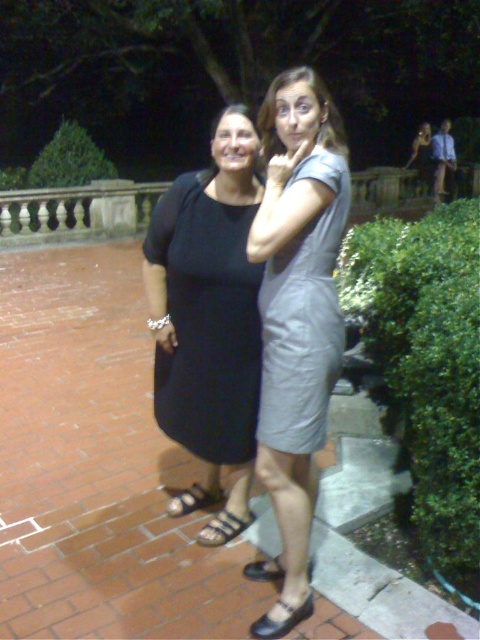
Is gray leather dress at center to the right of brown leather sandal at lower left from the viewer's perspective?

Yes, gray leather dress at center is to the right of brown leather sandal at lower left.

You are a GUI agent. You are given a task and a screenshot of the screen. Output one action in this format:
    pyautogui.click(x=<x>, y=<y>)
    Task: Click on the gray leather dress at center
    The width and height of the screenshot is (480, 640).
    Given the screenshot: What is the action you would take?
    pyautogui.click(x=298, y=300)

Does point (300, 109) lie in front of point (200, 506)?

That is True.

The width and height of the screenshot is (480, 640). Identify the location of gray leather dress at center. (298, 300).

Can you confirm if light gray leather dress at center is positioned to the right of black leather sandal at lower left?

Indeed, light gray leather dress at center is positioned on the right side of black leather sandal at lower left.

Does light gray leather dress at center appear on the left side of black leather sandal at lower left?

In fact, light gray leather dress at center is to the right of black leather sandal at lower left.

In order to click on light gray leather dress at center in this screenshot , I will do `click(302, 317)`.

Between light gray leather dress at center and brown leather sandal at lower left, which one appears on the left side from the viewer's perspective?

Positioned to the left is brown leather sandal at lower left.

Does light gray leather dress at center lie in front of brown leather sandal at lower left?

Yes, light gray leather dress at center is in front of brown leather sandal at lower left.

The height and width of the screenshot is (640, 480). Identify the location of light gray leather dress at center. (302, 317).